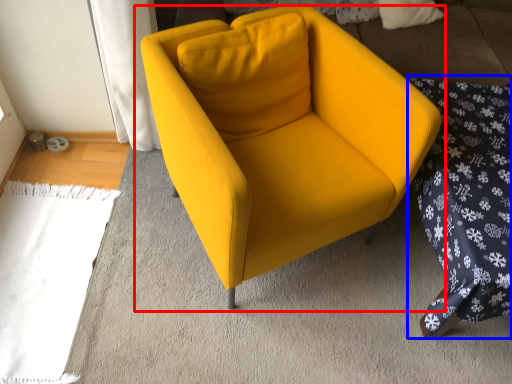
Question: Which object appears closest to the camera in this image, chair (highlighted by a red box) or bedding (highlighted by a blue box)?

Choices:
 (A) chair
 (B) bedding

Answer: (A)